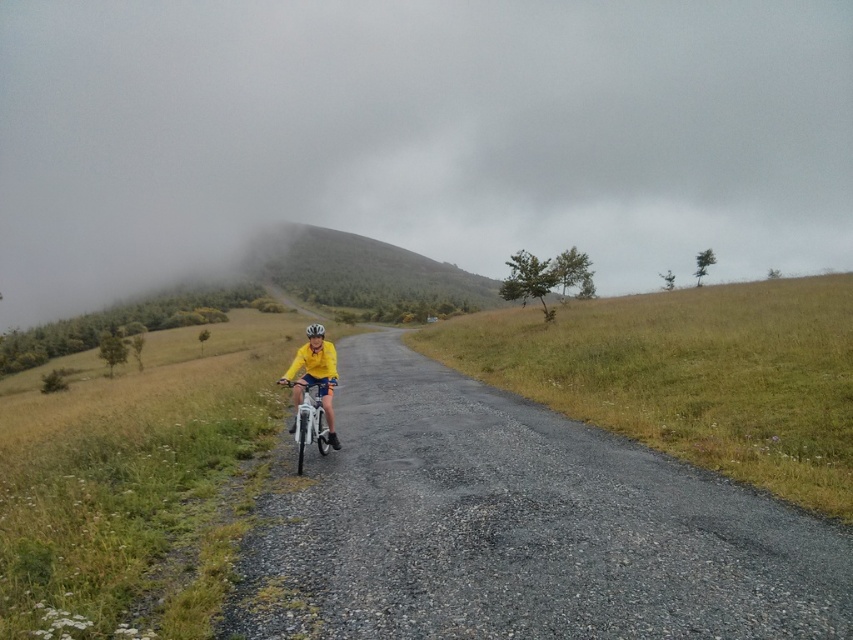
This screenshot has height=640, width=853. What do you see at coordinates (418, 134) in the screenshot? I see `foggy misty hillside at upper center` at bounding box center [418, 134].

Who is taller, foggy misty hillside at upper center or white matte bicycle at center?

foggy misty hillside at upper center

Is point (22, 45) in front of point (326, 435)?

That is False.

At what (x,y) coordinates should I click in order to perform the action: click on foggy misty hillside at upper center. Please return your answer as a coordinate pair (x, y). Looking at the image, I should click on tap(418, 134).

Based on the photo, between foggy misty hillside at upper center and yellow matte jacket at center, which one has less height?

With less height is yellow matte jacket at center.

Does foggy misty hillside at upper center appear on the right side of yellow matte jacket at center?

In fact, foggy misty hillside at upper center is to the left of yellow matte jacket at center.

In the scene shown: Who is more distant from viewer, (643, 225) or (317, 352)?

Point (643, 225)

The image size is (853, 640). I want to click on foggy misty hillside at upper center, so click(x=418, y=134).

Is yellow matte jacket at center positioned in front of white matte bicycle at center?

No, it is behind white matte bicycle at center.

Is yellow matte jacket at center smaller than white matte bicycle at center?

Correct, yellow matte jacket at center occupies less space than white matte bicycle at center.

Which is in front, point (323, 362) or point (296, 381)?

Point (296, 381)

Identify the location of yellow matte jacket at center. point(315,380).